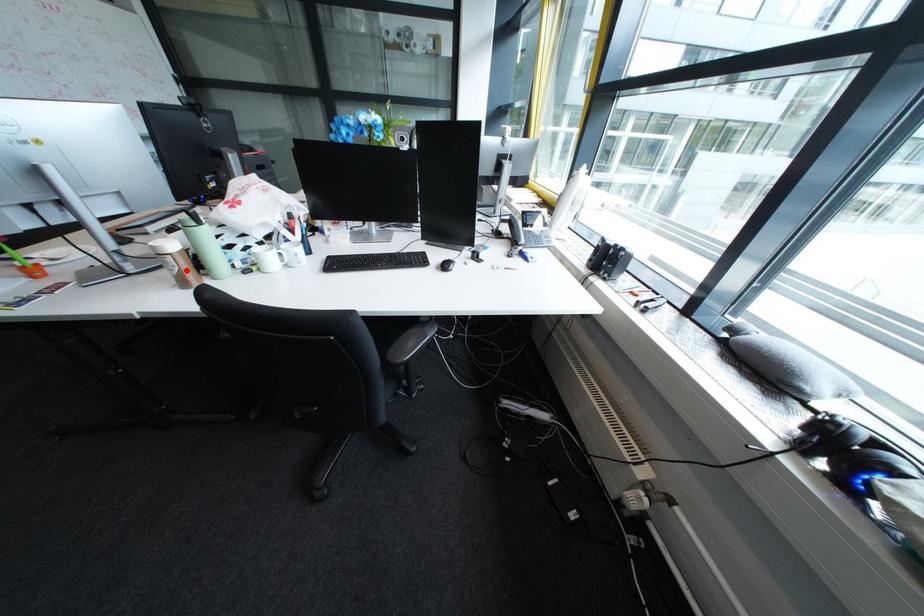
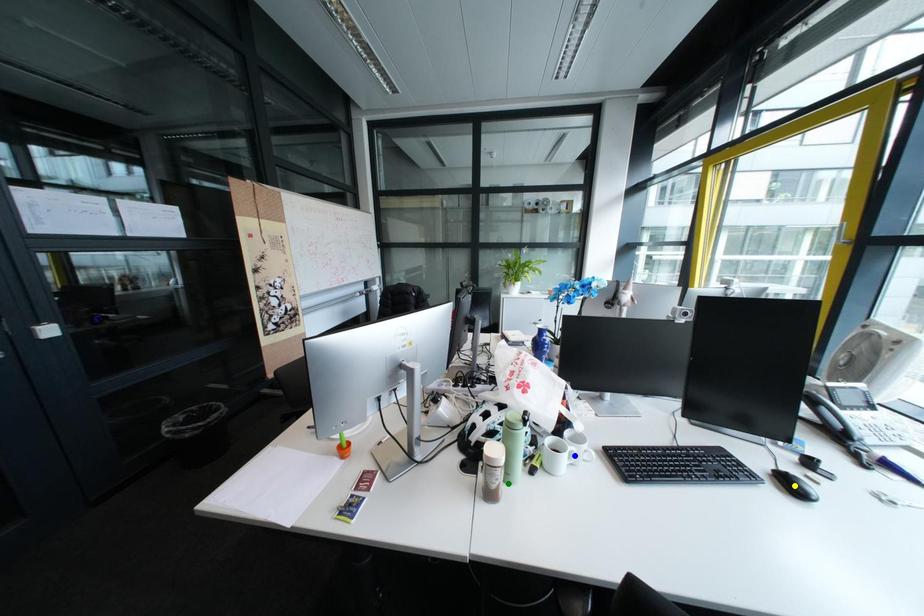
Question: I am providing you with two images of the same scene from different viewpoints. A red point is marked on the first image. You are given multiple points on the second image. Which point in image 2 represents the same 3d spot as the red point in image 1?

Choices:
 (A) yellow point
 (B) blue point
 (C) green point

Answer: (C)